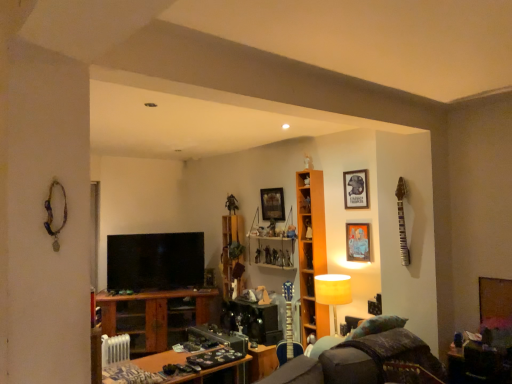
Question: Considering the relative sizes of matte black picture frame at upper right, the second picture frame viewed from the back, and velvet dark brown swivel chair at lower right in the image provided, is matte black picture frame at upper right, the second picture frame viewed from the back, wider than velvet dark brown swivel chair at lower right?

Choices:
 (A) yes
 (B) no

Answer: (B)

Question: From the image's perspective, is matte black picture frame at upper right, which is the third picture frame from left to right, over velvet dark brown swivel chair at lower right?

Choices:
 (A) yes
 (B) no

Answer: (A)

Question: Is matte black picture frame at upper right, which is the 1th picture frame from right to left, positioned beyond the bounds of velvet dark brown swivel chair at lower right?

Choices:
 (A) yes
 (B) no

Answer: (A)

Question: Does matte black picture frame at upper right, which is the third picture frame from left to right, have a larger size compared to velvet dark brown swivel chair at lower right?

Choices:
 (A) yes
 (B) no

Answer: (B)

Question: Can velvet dark brown swivel chair at lower right be found inside matte black picture frame at upper right, which is the 1th picture frame from right to left?

Choices:
 (A) no
 (B) yes

Answer: (A)

Question: In terms of width, does matte black picture frame at upper right, which is the third picture frame from left to right, look wider or thinner when compared to metallic figure at upper center?

Choices:
 (A) thin
 (B) wide

Answer: (A)

Question: In the image, is matte black picture frame at upper right, the second picture frame viewed from the back, positioned in front of or behind metallic figure at upper center?

Choices:
 (A) behind
 (B) front

Answer: (B)

Question: In terms of size, does matte black picture frame at upper right, the second picture frame viewed from the back, appear bigger or smaller than metallic figure at upper center?

Choices:
 (A) small
 (B) big

Answer: (A)

Question: Is point (368, 205) positioned closer to the camera than point (227, 200)?

Choices:
 (A) farther
 (B) closer

Answer: (B)

Question: Is wooden shelves at center, placed as the 2th cabinet when sorted from right to left, wider or thinner than wooden cabinet at center, marked as the 3th cabinet in a right-to-left arrangement?

Choices:
 (A) wide
 (B) thin

Answer: (B)

Question: In terms of height, does wooden shelves at center, the 2th cabinet viewed from the front, look taller or shorter compared to wooden cabinet at center, which is the 3th cabinet from front to back?

Choices:
 (A) tall
 (B) short

Answer: (B)

Question: Is wooden shelves at center, the 2th cabinet viewed from the front, bigger or smaller than wooden cabinet at center, the first cabinet when ordered from left to right?

Choices:
 (A) small
 (B) big

Answer: (B)

Question: From a real-world perspective, is wooden shelves at center, positioned as the second cabinet in left-to-right order, above or below wooden cabinet at center, marked as the 3th cabinet in a right-to-left arrangement?

Choices:
 (A) above
 (B) below

Answer: (A)

Question: From a real-world perspective, is matte black picture frame at upper right, which is the third picture frame from left to right, physically located above or below matte yellow lampshade at center?

Choices:
 (A) above
 (B) below

Answer: (A)

Question: Is matte black picture frame at upper right, the second picture frame viewed from the front, spatially inside matte yellow lampshade at center, or outside of it?

Choices:
 (A) outside
 (B) inside

Answer: (A)